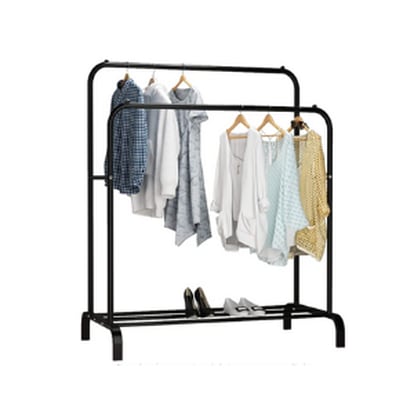
Where is `hangers`? hangers is located at coordinates (128, 77), (152, 79), (182, 77), (240, 120), (269, 122), (299, 120).